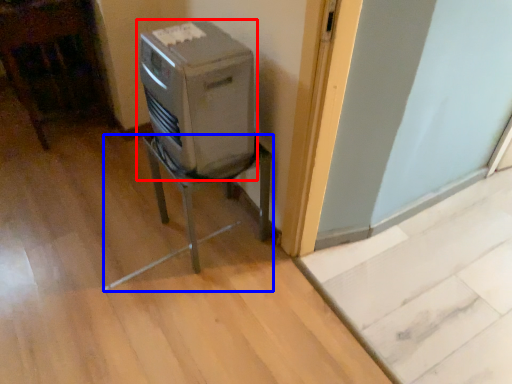
Question: Which object appears closest to the camera in this image, home appliance (highlighted by a red box) or furniture (highlighted by a blue box)?

Choices:
 (A) home appliance
 (B) furniture

Answer: (A)